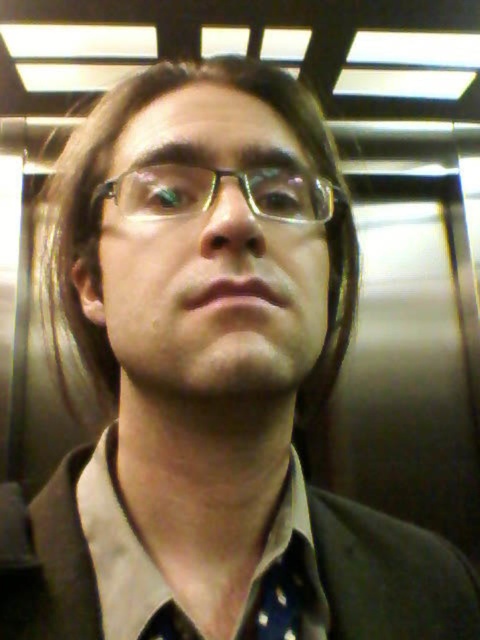
Question: Is gold-framed glasses at center thinner than polka dot fabric tie at center?

Choices:
 (A) yes
 (B) no

Answer: (B)

Question: Which of the following is the farthest from the observer?

Choices:
 (A) (193, 636)
 (B) (275, 596)
 (C) (191, 189)

Answer: (B)

Question: Which point is farther to the camera?

Choices:
 (A) (203, 209)
 (B) (171, 612)

Answer: (B)

Question: Does light brown cotton shirt at center appear on the right side of blue dotted fabric at center?

Choices:
 (A) no
 (B) yes

Answer: (A)

Question: Is blue dotted fabric at center positioned in front of polka dot fabric tie at center?

Choices:
 (A) no
 (B) yes

Answer: (A)

Question: Which object appears closest to the camera in this image?

Choices:
 (A) blue dotted fabric at center
 (B) polka dot fabric tie at center

Answer: (B)